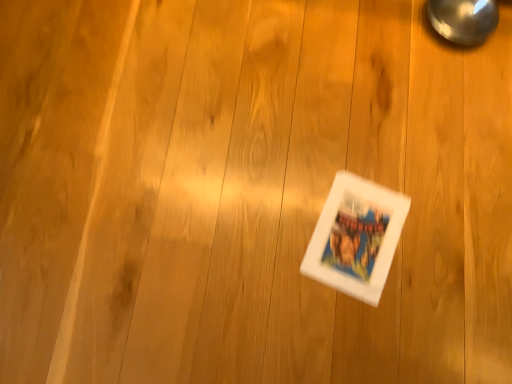
Question: In the image, is white matte comic book at center on the left side or the right side of polished metallic magnifying glass at upper right?

Choices:
 (A) right
 (B) left

Answer: (B)

Question: Is white matte comic book at center in front of or behind polished metallic magnifying glass at upper right in the image?

Choices:
 (A) front
 (B) behind

Answer: (A)

Question: From a real-world perspective, relative to polished metallic magnifying glass at upper right, is white matte comic book at center vertically above or below?

Choices:
 (A) above
 (B) below

Answer: (B)

Question: From the image's perspective, is polished metallic magnifying glass at upper right above or below white matte comic book at center?

Choices:
 (A) below
 (B) above

Answer: (B)

Question: Looking at their shapes, would you say polished metallic magnifying glass at upper right is wider or thinner than white matte comic book at center?

Choices:
 (A) wide
 (B) thin

Answer: (B)

Question: Is point (446, 6) positioned closer to the camera than point (362, 281)?

Choices:
 (A) farther
 (B) closer

Answer: (A)

Question: Based on their sizes in the image, would you say polished metallic magnifying glass at upper right is bigger or smaller than white matte comic book at center?

Choices:
 (A) big
 (B) small

Answer: (A)